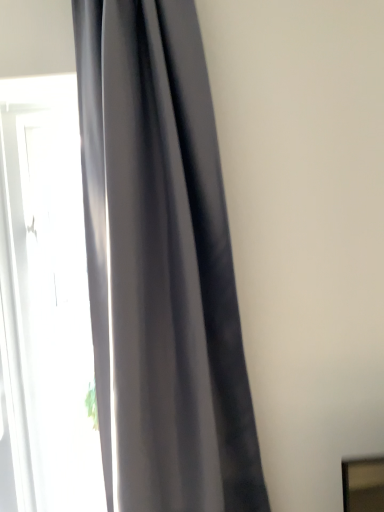
This screenshot has width=384, height=512. What are the coordinates of `matte gray curtain at left` in the screenshot? It's located at (161, 266).

What do you see at coordinates (161, 266) in the screenshot? I see `matte gray curtain at left` at bounding box center [161, 266].

I want to click on matte gray curtain at left, so click(x=161, y=266).